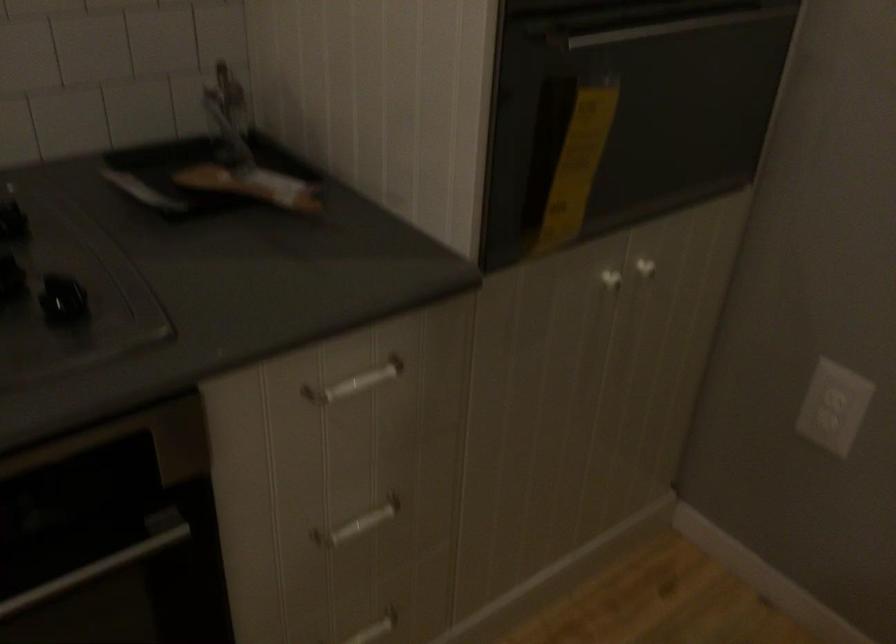
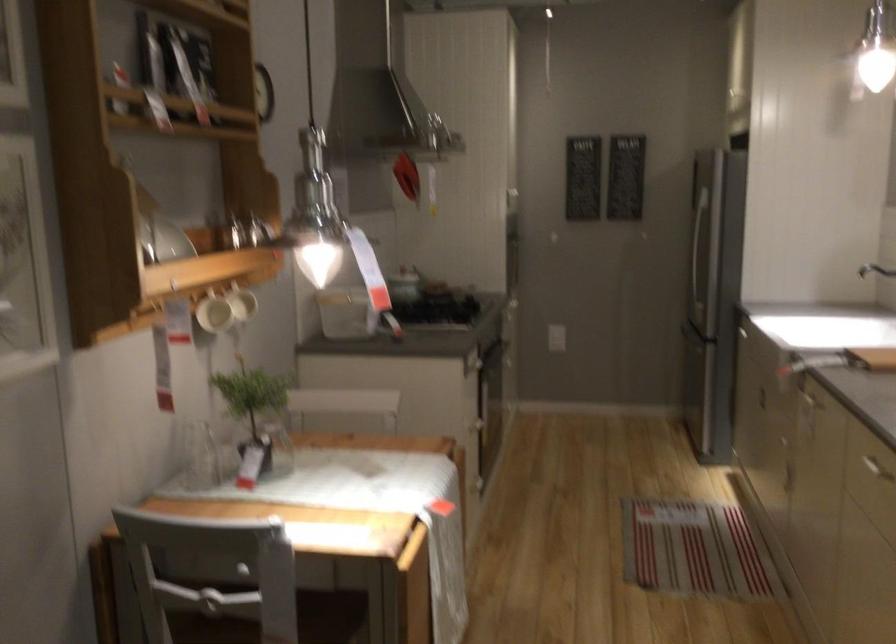
Question: I am providing you with two images of the same scene from different viewpoints. Please identify which objects are invisible in image2.

Choices:
 (A) white mug handle
 (B) chrome shower dial
 (C) white drawer handle
 (D) refrigerator door handle

Answer: (C)